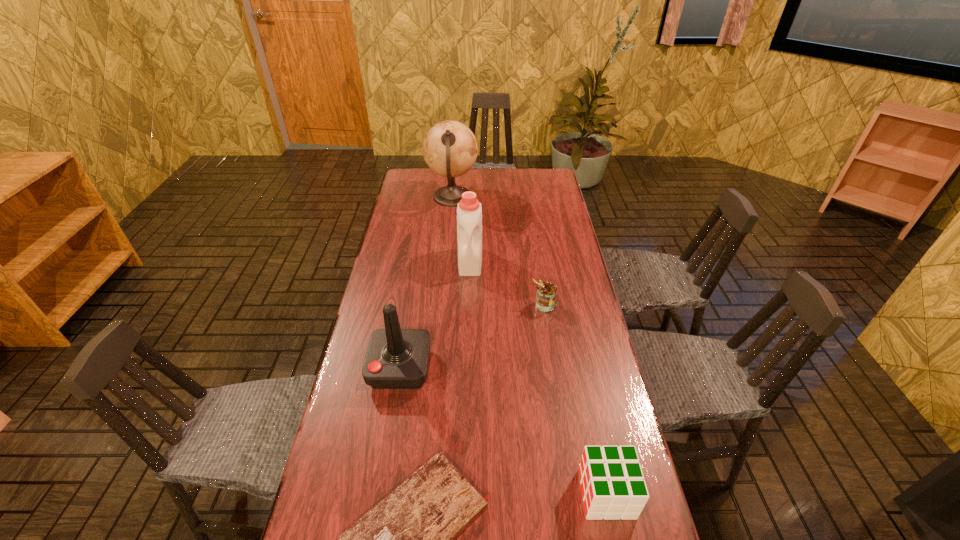
Select which object is the fourth closest to the can. Please provide its 2D coordinates. Your answer should be formatted as a tuple, i.e. [(x, y)], where the tuple contains the x and y coordinates of a point satisfying the conditions above.

[(612, 482)]

You are a GUI agent. You are given a task and a screenshot of the screen. Output one action in this format:
    pyautogui.click(x=<x>, y=<y>)
    Task: Click on the free region that satisfies the following two spatial constraints: 1. on the handle side of the fifth nearest object; 2. on the left side of the third farthest object
    Image resolution: width=960 pixels, height=540 pixels.
    Given the screenshot: What is the action you would take?
    pyautogui.click(x=469, y=305)

Where is `free space that satisfies the following two spatial constraints: 1. on the back side of the third nearest object; 2. on the right side of the fourth nearest object`? The width and height of the screenshot is (960, 540). free space that satisfies the following two spatial constraints: 1. on the back side of the third nearest object; 2. on the right side of the fourth nearest object is located at coordinates (411, 305).